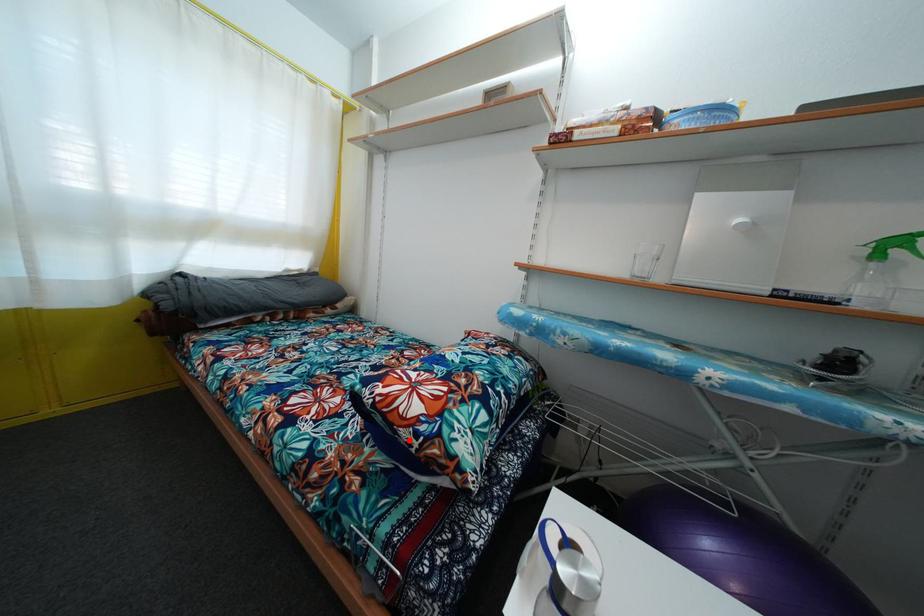
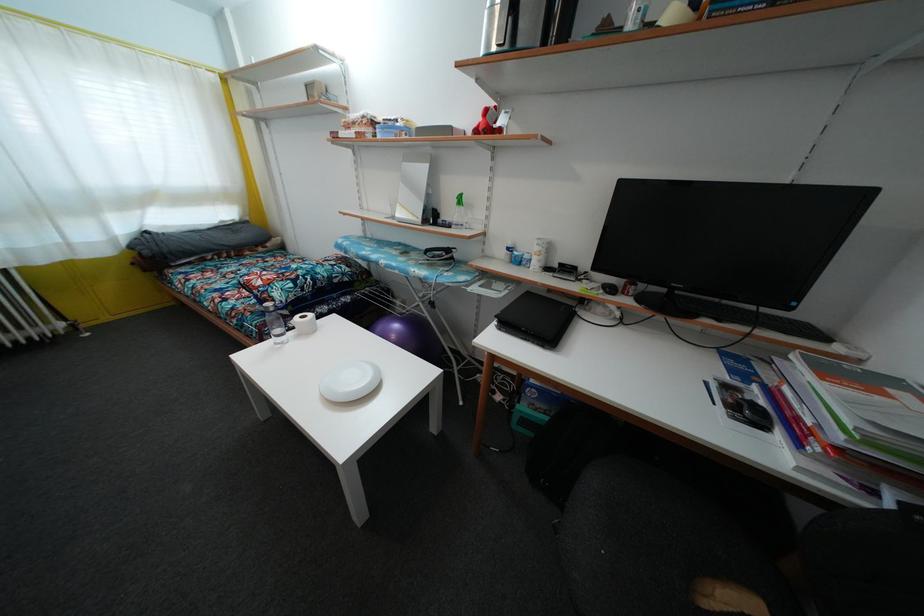
Find the pixel in the second image that matches the highlighted location in the first image.

(259, 299)